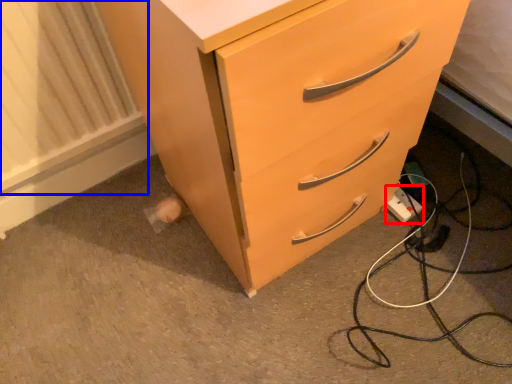
Question: Which object is closer to the camera taking this photo, electric outlet (highlighted by a red box) or radiator (highlighted by a blue box)?

Choices:
 (A) electric outlet
 (B) radiator

Answer: (B)